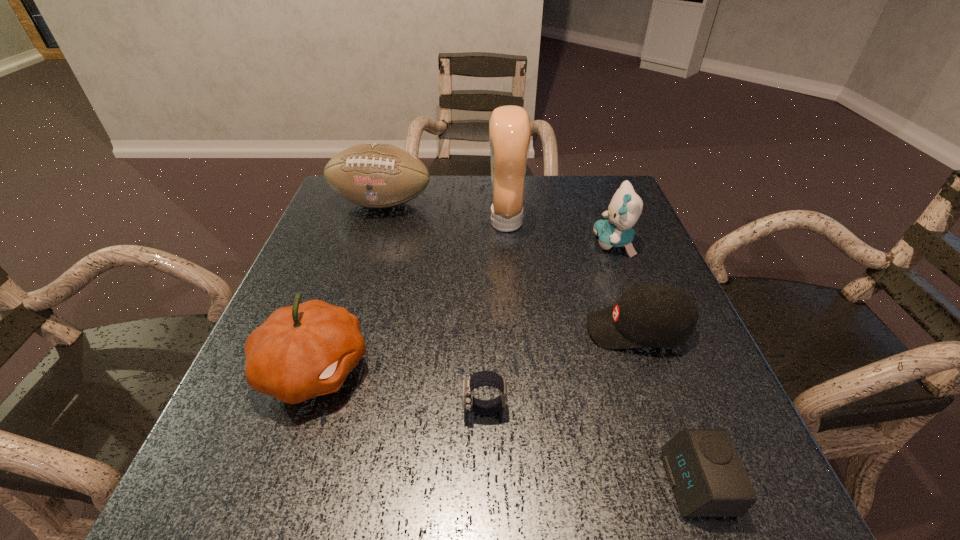
The image size is (960, 540). Identify the location of vacant space at the far right corner of the desktop. (587, 180).

I want to click on free area in between the fifth tallest object and the pumpkin, so click(x=476, y=349).

Image resolution: width=960 pixels, height=540 pixels. I want to click on vacant region between the shortest object and the pumpkin, so click(506, 426).

Find the location of a particular element. Image resolution: width=960 pixels, height=540 pixels. free space between the fifth tallest object and the watch is located at coordinates (561, 369).

The height and width of the screenshot is (540, 960). What are the coordinates of `free space between the tallest object and the football (American)` in the screenshot? It's located at (444, 213).

Locate an element on the screen. The width and height of the screenshot is (960, 540). empty location between the watch and the nearest object is located at coordinates pos(591,446).

This screenshot has height=540, width=960. I want to click on vacant space that is in between the watch and the nearest object, so click(591, 446).

Where is `vacant point located between the football (American) and the pumpkin`? The image size is (960, 540). vacant point located between the football (American) and the pumpkin is located at coordinates (348, 286).

Find the location of a particular element. The width and height of the screenshot is (960, 540). free space between the condiment and the football (American) is located at coordinates (444, 213).

Identify the location of vacant space that's between the fifth tallest object and the shortest object. (667, 406).